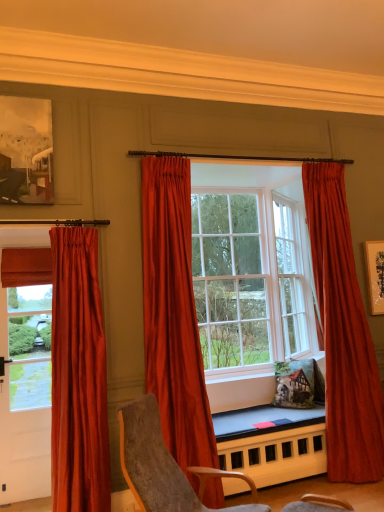
Question: From the image's perspective, is satin orange curtain at center, placed as the 2th curtain when sorted from left to right, located beneath smooth wooden table at center?

Choices:
 (A) yes
 (B) no

Answer: (B)

Question: Can you confirm if satin orange curtain at center, which ranks as the 2th curtain in right-to-left order, is smaller than smooth wooden table at center?

Choices:
 (A) no
 (B) yes

Answer: (A)

Question: Is satin orange curtain at center, placed as the 2th curtain when sorted from left to right, bigger than smooth wooden table at center?

Choices:
 (A) yes
 (B) no

Answer: (A)

Question: Is satin orange curtain at center, placed as the 2th curtain when sorted from left to right, at the right side of smooth wooden table at center?

Choices:
 (A) no
 (B) yes

Answer: (A)

Question: Does satin orange curtain at center, placed as the 2th curtain when sorted from left to right, have a greater height compared to smooth wooden table at center?

Choices:
 (A) no
 (B) yes

Answer: (B)

Question: In terms of width, does matte wooden picture frame at upper left look wider or thinner when compared to satin orange curtain at center, which ranks as the 2th curtain in right-to-left order?

Choices:
 (A) thin
 (B) wide

Answer: (A)

Question: Considering the positions of matte wooden picture frame at upper left and satin orange curtain at center, placed as the 2th curtain when sorted from left to right, in the image, is matte wooden picture frame at upper left bigger or smaller than satin orange curtain at center, placed as the 2th curtain when sorted from left to right,?

Choices:
 (A) small
 (B) big

Answer: (A)

Question: In terms of height, does matte wooden picture frame at upper left look taller or shorter compared to satin orange curtain at center, which ranks as the 2th curtain in right-to-left order?

Choices:
 (A) short
 (B) tall

Answer: (A)

Question: Choose the correct answer: Is matte wooden picture frame at upper left inside satin orange curtain at center, which ranks as the 2th curtain in right-to-left order, or outside it?

Choices:
 (A) inside
 (B) outside

Answer: (B)

Question: Would you say smooth wooden table at center is to the left or to the right of satin red curtain at center, which appears as the 1th curtain when viewed from the right, in the picture?

Choices:
 (A) left
 (B) right

Answer: (A)

Question: Is point (251, 443) positioned closer to the camera than point (336, 188)?

Choices:
 (A) closer
 (B) farther

Answer: (A)

Question: From a real-world perspective, is smooth wooden table at center above or below satin red curtain at center, which appears as the 1th curtain when viewed from the right?

Choices:
 (A) above
 (B) below

Answer: (B)

Question: Looking at the image, does smooth wooden table at center seem bigger or smaller compared to satin red curtain at center, positioned as the third curtain in left-to-right order?

Choices:
 (A) small
 (B) big

Answer: (A)

Question: Considering the positions of satin orange curtain at center, which ranks as the 2th curtain in right-to-left order, and matte wooden picture frame at upper left in the image, is satin orange curtain at center, which ranks as the 2th curtain in right-to-left order, taller or shorter than matte wooden picture frame at upper left?

Choices:
 (A) short
 (B) tall

Answer: (B)

Question: Is point (192, 421) closer or farther from the camera than point (6, 166)?

Choices:
 (A) closer
 (B) farther

Answer: (B)